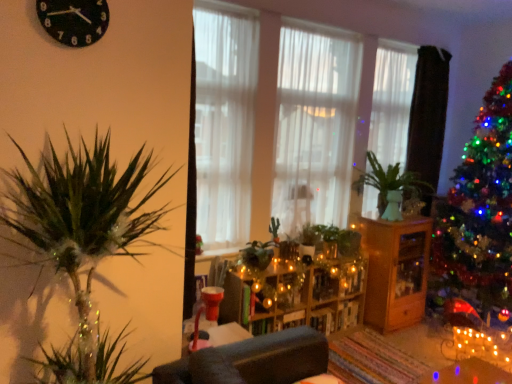
The image size is (512, 384). Identify the location of vacant region above white sheer curtain at center, which is the third curtain from left to right (from a real-world perspective). (394, 41).